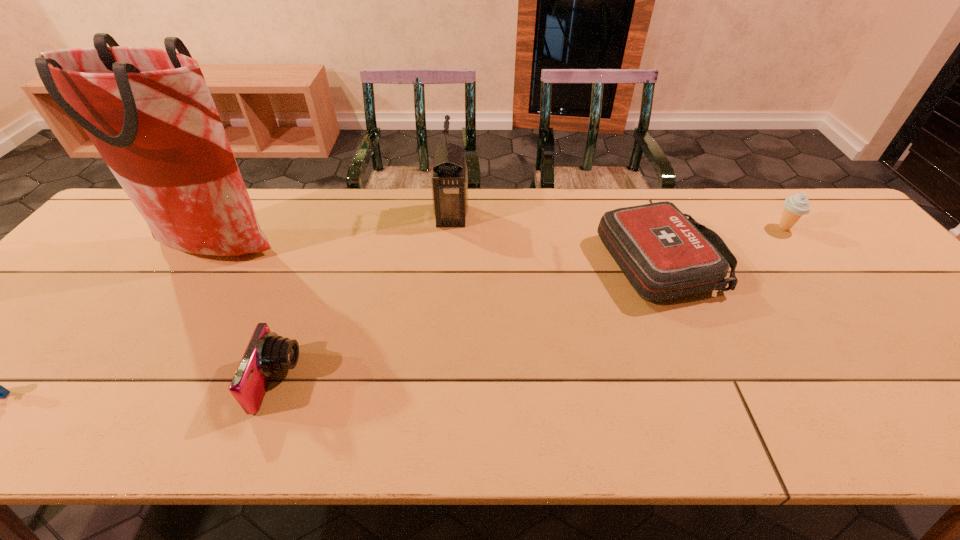
The height and width of the screenshot is (540, 960). In order to click on grocery bag in this screenshot , I will do `click(149, 113)`.

Identify the location of the second object from left to right. The height and width of the screenshot is (540, 960). (149, 113).

Identify the location of the fifth shortest object. Image resolution: width=960 pixels, height=540 pixels. (449, 182).

You are a GUI agent. You are given a task and a screenshot of the screen. Output one action in this format:
    pyautogui.click(x=<x>, y=<y>)
    Task: Click on the lantern
    The image size is (960, 540).
    Given the screenshot: What is the action you would take?
    pyautogui.click(x=449, y=182)

What are the coordinates of `the rightmost object` in the screenshot? It's located at (796, 205).

The image size is (960, 540). I want to click on the fifth object from left to right, so click(663, 254).

Find the location of a particular element. The width and height of the screenshot is (960, 540). the fourth object from right to left is located at coordinates click(x=267, y=353).

This screenshot has width=960, height=540. What are the coordinates of `free space located 0.110m on the right of the tallest object` in the screenshot? It's located at tap(322, 248).

Locate an element on the screen. The image size is (960, 540). free location located 0.290m on the front-facing side of the lantern is located at coordinates (564, 215).

At what (x,y) coordinates should I click in order to perform the action: click on vacant space situated 0.060m on the back of the icecream. Please return your answer as a coordinate pair (x, y). The width and height of the screenshot is (960, 540). Looking at the image, I should click on (769, 209).